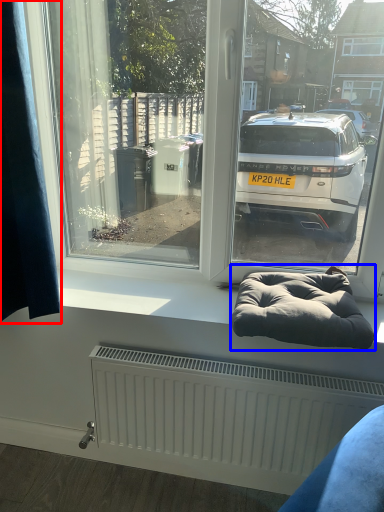
Question: Which object is further to the camera taking this photo, curtain (highlighted by a red box) or bean bag chair (highlighted by a blue box)?

Choices:
 (A) curtain
 (B) bean bag chair

Answer: (B)